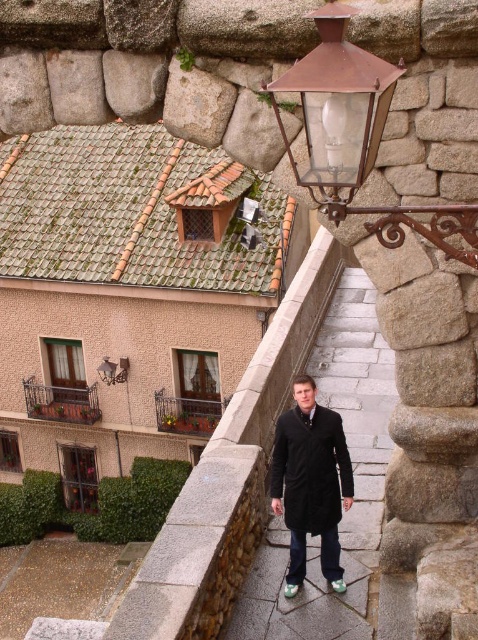
Question: Among these points, which one is nearest to the camera?

Choices:
 (A) (166, 406)
 (B) (317, 179)
 (C) (89, 420)

Answer: (B)

Question: Does rusty metal lantern at upper right have a greater width compared to rustic wrought iron balcony at lower left?

Choices:
 (A) no
 (B) yes

Answer: (A)

Question: Is rustic wrought iron balcony at center to the right of matte copper lantern at upper center from the viewer's perspective?

Choices:
 (A) yes
 (B) no

Answer: (A)

Question: Which point appears farthest from the camera in this image?

Choices:
 (A) (352, 150)
 (B) (311, 384)

Answer: (B)

Question: Can you confirm if rusty metal lantern at upper right is wider than matte copper lantern at upper center?

Choices:
 (A) no
 (B) yes

Answer: (B)

Question: Which point is farther from the camera taking this photo?

Choices:
 (A) (50, 401)
 (B) (401, 68)

Answer: (A)